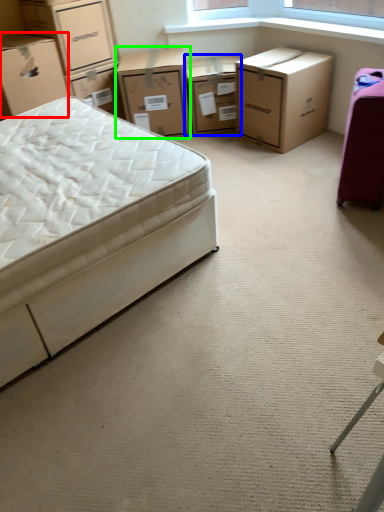
Question: Estimate the real-world distances between objects in this image. Which object is farther from box (highlighted by a red box), chest of drawers (highlighted by a blue box) or chest of drawers (highlighted by a green box)?

Choices:
 (A) chest of drawers
 (B) chest of drawers

Answer: (A)